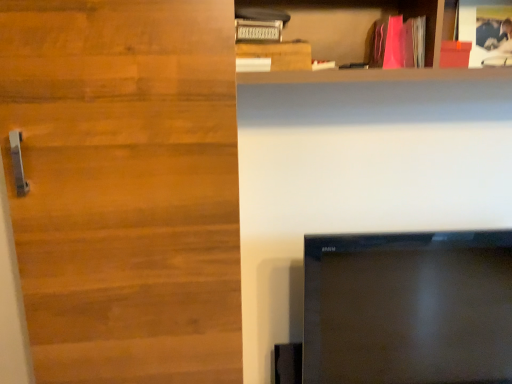
Question: From a real-world perspective, is black glossy tv at lower right physically above wooden door at left?

Choices:
 (A) yes
 (B) no

Answer: (B)

Question: Is black glossy tv at lower right not within wooden door at left?

Choices:
 (A) yes
 (B) no

Answer: (A)

Question: Can you confirm if black glossy tv at lower right is taller than wooden door at left?

Choices:
 (A) no
 (B) yes

Answer: (A)

Question: Would you consider black glossy tv at lower right to be distant from wooden door at left?

Choices:
 (A) yes
 (B) no

Answer: (B)

Question: Is black glossy tv at lower right positioned before wooden door at left?

Choices:
 (A) no
 (B) yes

Answer: (A)

Question: Is black glossy tv at lower right bigger or smaller than wooden plank at upper center?

Choices:
 (A) big
 (B) small

Answer: (A)

Question: In terms of height, does black glossy tv at lower right look taller or shorter compared to wooden plank at upper center?

Choices:
 (A) short
 (B) tall

Answer: (B)

Question: Is black glossy tv at lower right in front of or behind wooden plank at upper center in the image?

Choices:
 (A) front
 (B) behind

Answer: (A)

Question: In the image, is black glossy tv at lower right on the left side or the right side of wooden plank at upper center?

Choices:
 (A) right
 (B) left

Answer: (A)

Question: In the image, is matte wooden shelf at upper right on the left side or the right side of wooden plank at upper center?

Choices:
 (A) right
 (B) left

Answer: (A)

Question: In terms of size, does matte wooden shelf at upper right appear bigger or smaller than wooden plank at upper center?

Choices:
 (A) big
 (B) small

Answer: (A)

Question: From a real-world perspective, relative to wooden plank at upper center, is matte wooden shelf at upper right vertically above or below?

Choices:
 (A) above
 (B) below

Answer: (A)

Question: From their relative heights in the image, would you say matte wooden shelf at upper right is taller or shorter than wooden plank at upper center?

Choices:
 (A) short
 (B) tall

Answer: (B)

Question: From their relative heights in the image, would you say matte wooden shelf at upper right is taller or shorter than pink matte book at upper right?

Choices:
 (A) tall
 (B) short

Answer: (A)

Question: Considering the positions of matte wooden shelf at upper right and pink matte book at upper right in the image, is matte wooden shelf at upper right bigger or smaller than pink matte book at upper right?

Choices:
 (A) small
 (B) big

Answer: (B)